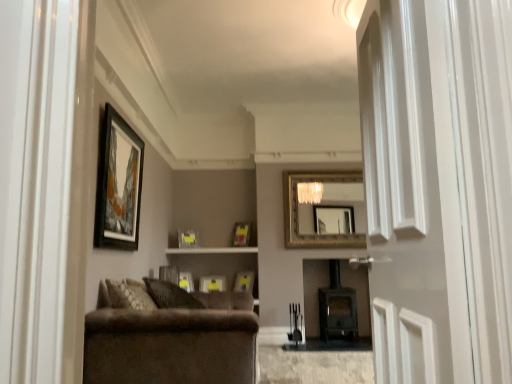
Question: Choose the correct answer: Is wooden picture frame at upper left, acting as the 7th picture frame starting from the back, inside dark brown wood fireplace at center or outside it?

Choices:
 (A) outside
 (B) inside

Answer: (A)

Question: In terms of width, does wooden picture frame at upper left, acting as the 7th picture frame starting from the back, look wider or thinner when compared to dark brown wood fireplace at center?

Choices:
 (A) thin
 (B) wide

Answer: (A)

Question: Which is farther from the matte black picture frame at center, the fourth picture frame viewed from the back?

Choices:
 (A) matte yellow picture frame at center, placed as the seventh picture frame when sorted from front to back
 (B) matte silver picture frame at center, which is the 5th picture frame in back-to-front order
 (C) matte wood shelf at center
 (D) matte black picture frame at center, placed as the second picture frame when sorted from front to back
 (E) white glossy door at center

Answer: (E)

Question: Considering the real-world distances, which object is farthest from the matte silver picture frame at center, which is the 5th picture frame in back-to-front order?

Choices:
 (A) dark brown wood fireplace at center
 (B) velvet brown couch at lower left
 (C) matte black picture frame at center, the fourth picture frame viewed from the back
 (D) gold-framed mirror at upper center
 (E) matte black picture frame at center, placed as the second picture frame when sorted from front to back

Answer: (B)